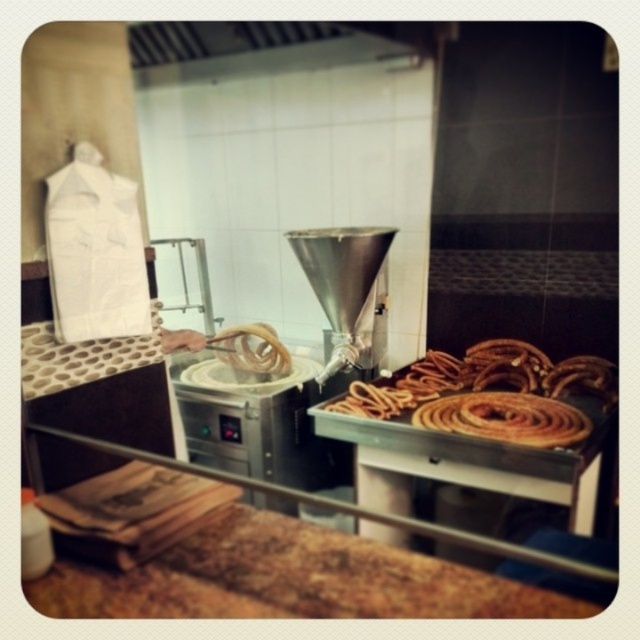
Based on the photo, which of these two, crispy golden churros at center or brown crispy pastry at right, stands taller?

Standing taller between the two is crispy golden churros at center.

Does crispy golden churros at center have a smaller size compared to brown crispy pastry at right?

No.

Which is behind, point (536, 396) or point (449, 419)?

Point (536, 396)

At what (x,y) coordinates should I click in order to perform the action: click on crispy golden churros at center. Please return your answer as a coordinate pair (x, y). Looking at the image, I should click on (492, 394).